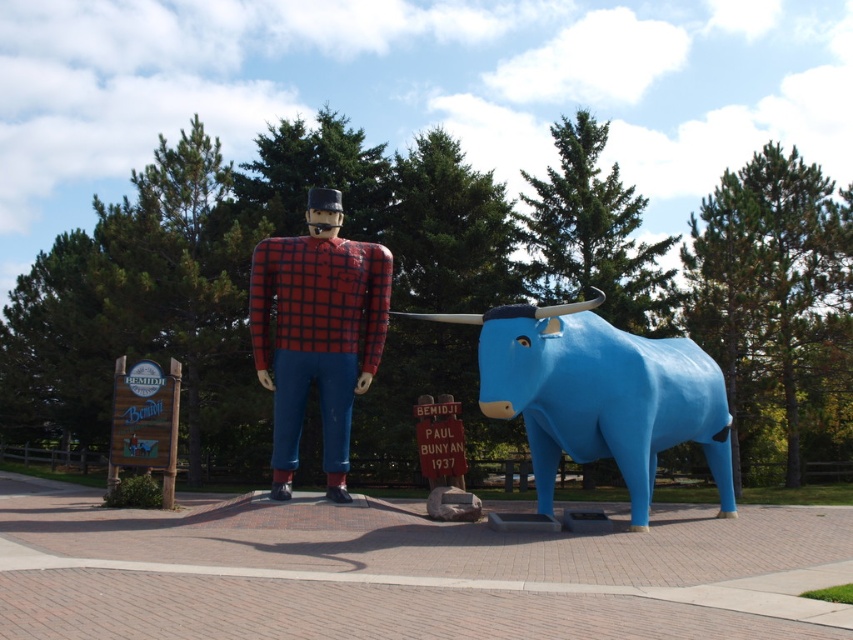
Who is positioned more to the left, blue glossy bull at center or red plaid shirt at center?

Positioned to the left is red plaid shirt at center.

Who is lower down, blue glossy bull at center or red plaid shirt at center?

blue glossy bull at center is lower down.

Who is more forward, (563, 368) or (273, 387)?

Point (563, 368) is in front.

This screenshot has width=853, height=640. In order to click on blue glossy bull at center in this screenshot , I will do `click(599, 396)`.